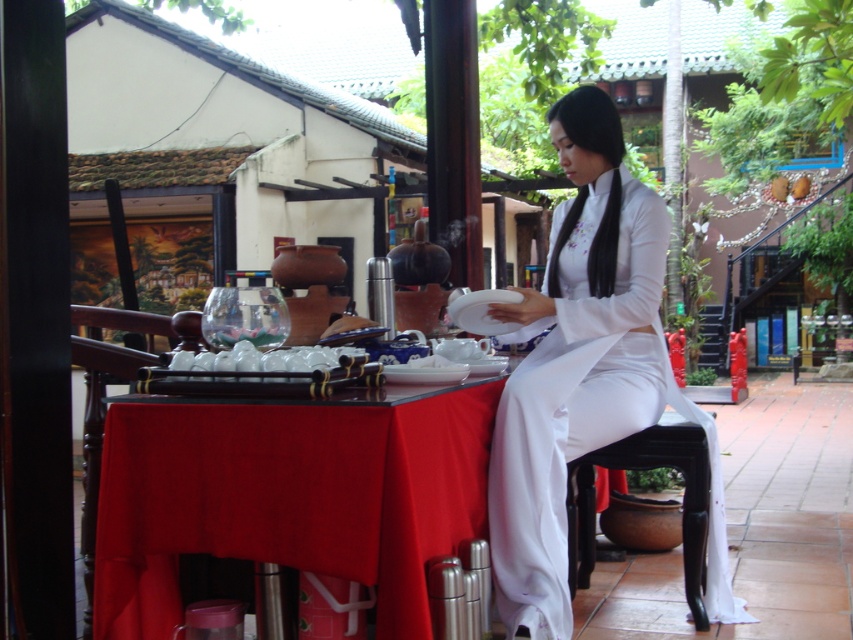
You are a photographer planning to capture the scene of the traditional Vietnamese tea ceremony. You notice the smooth red cloth at center and the white silk ao dai at center. Which object should you focus on if you want to highlight the wider one in your composition?

The smooth red cloth at center is wider than the white silk ao dai at center, so focusing on the smooth red cloth at center would highlight the wider object in the composition.

You are a photographer planning to take a closeup shot of the smooth red cloth at center and the white silk ao dai at center. Given their sizes, which one would require you to move closer to capture the entire subject in the frame?

The smooth red cloth at center has a smaller size compared to the white silk ao dai at center, so you would need to move closer to capture the smooth red cloth at center in its entirety.